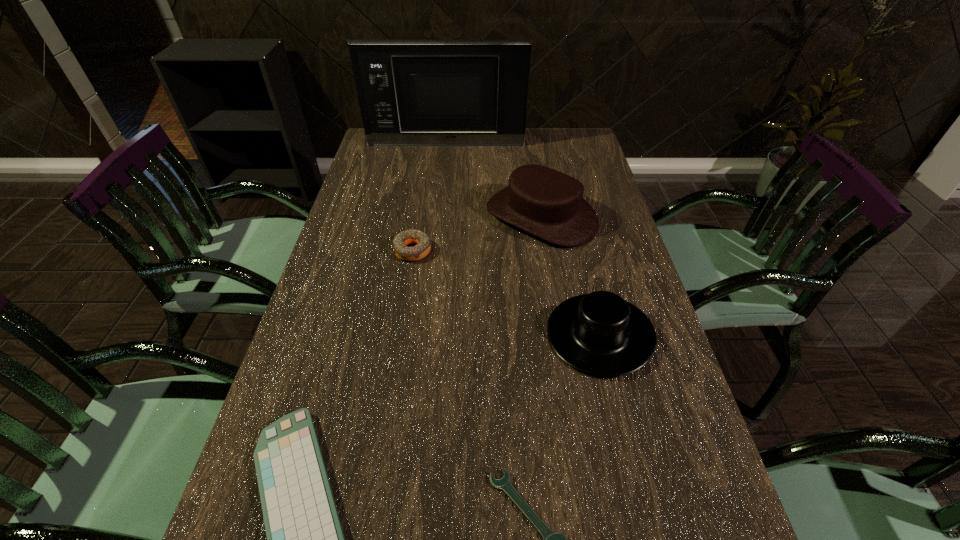
Image resolution: width=960 pixels, height=540 pixels. I want to click on the tallest object, so click(x=411, y=92).

Where is `the farthest object`? The image size is (960, 540). the farthest object is located at coordinates (411, 92).

This screenshot has height=540, width=960. I want to click on the second tallest object, so click(544, 202).

I want to click on the taller dress hat, so click(544, 202).

Where is `the shorter dress hat`? Image resolution: width=960 pixels, height=540 pixels. the shorter dress hat is located at coordinates click(601, 334).

In order to click on the nearer dress hat in this screenshot , I will do `click(601, 334)`.

At what (x,y) coordinates should I click in order to perform the action: click on the third shortest object. Please return your answer as a coordinate pair (x, y). The image size is (960, 540). Looking at the image, I should click on (421, 250).

Where is `vacant position located 0.400m on the front panel of the microwave oven`? vacant position located 0.400m on the front panel of the microwave oven is located at coordinates (439, 210).

At what (x,y) coordinates should I click in order to perform the action: click on vacant space located on the front of the fifth shortest object. Please return your answer as a coordinate pair (x, y). Looking at the image, I should click on (549, 267).

The height and width of the screenshot is (540, 960). In order to click on vacant space located on the front of the nearer dress hat in this screenshot , I will do `click(626, 445)`.